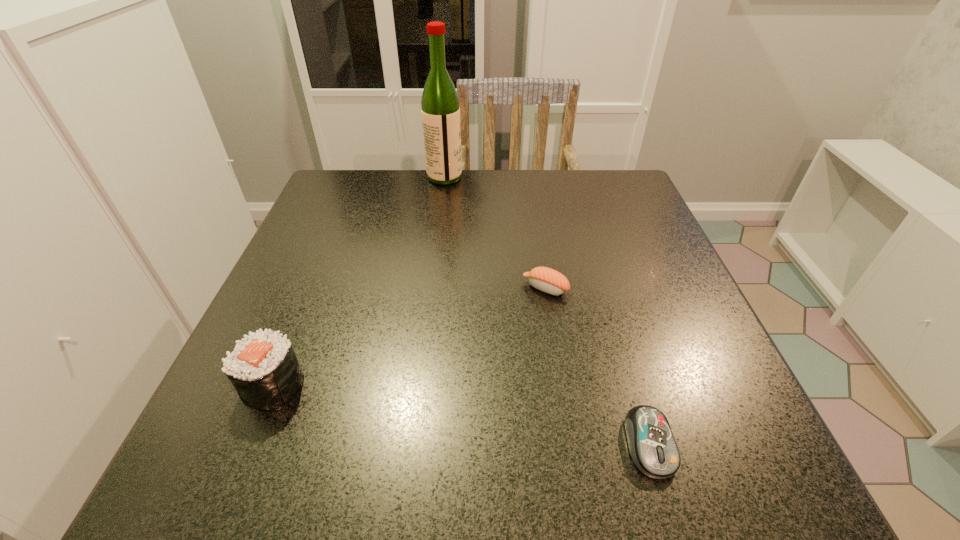
Image resolution: width=960 pixels, height=540 pixels. What are the coordinates of `the tallest object` in the screenshot? It's located at (440, 111).

You are a GUI agent. You are given a task and a screenshot of the screen. Output one action in this format:
    pyautogui.click(x=<x>, y=<y>)
    Task: Click on the second object from left to right
    The height and width of the screenshot is (540, 960).
    Given the screenshot: What is the action you would take?
    pyautogui.click(x=440, y=111)

Locate an element on the screen. the third shortest object is located at coordinates (263, 368).

Find the location of `the leftmost object`. the leftmost object is located at coordinates (263, 368).

Identify the location of the second object from right to left. click(x=545, y=279).

The image size is (960, 540). I want to click on the farther sushi, so click(x=545, y=279).

Identify the location of the rightmost object. (652, 446).

The width and height of the screenshot is (960, 540). Find the location of `computer mouse`. computer mouse is located at coordinates (652, 446).

Where is `vacant point located on the label of the farthest object`? The image size is (960, 540). vacant point located on the label of the farthest object is located at coordinates (521, 177).

Find the location of a particular element. This screenshot has width=960, height=540. free region located on the front of the second nearest object is located at coordinates (228, 493).